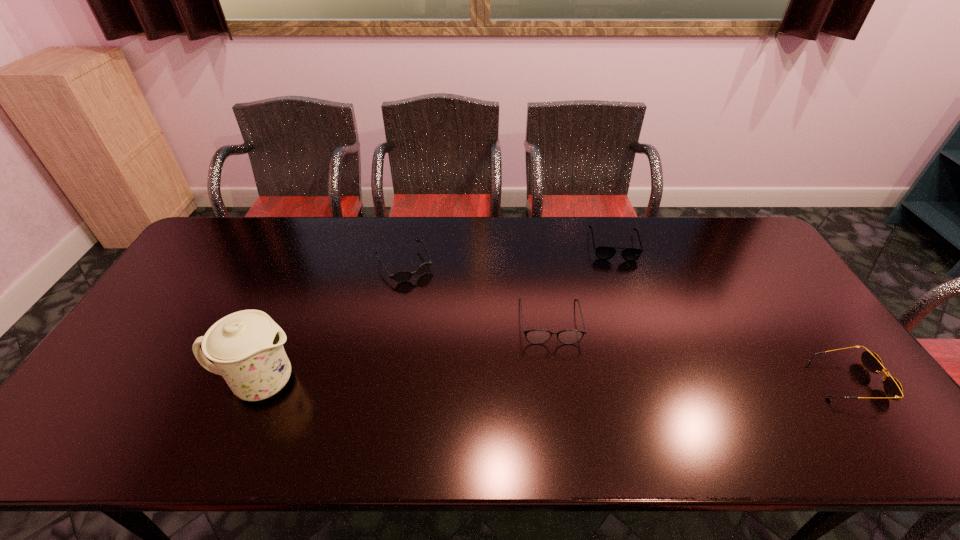
Where is `free space between the right spectacles and the third object from right to left`? This screenshot has width=960, height=540. free space between the right spectacles and the third object from right to left is located at coordinates (582, 283).

Locate an element on the screen. Image resolution: width=960 pixels, height=540 pixels. blank region between the farther sunglasses and the farther spectacles is located at coordinates (509, 254).

Locate an element on the screen. This screenshot has height=540, width=960. free space between the farther spectacles and the nearer spectacles is located at coordinates (582, 283).

The image size is (960, 540). I want to click on vacant area between the chinaware and the right sunglasses, so click(x=554, y=382).

The image size is (960, 540). In order to click on vacant region between the fourth object from left to right and the chinaware in this screenshot , I will do `click(437, 313)`.

I want to click on unoccupied position between the farther sunglasses and the nearer sunglasses, so click(626, 323).

Locate an element on the screen. The height and width of the screenshot is (540, 960). free point between the rightmost object and the third object from right to left is located at coordinates (698, 352).

Where is `empty location between the left spectacles and the fourth object from right to left`? empty location between the left spectacles and the fourth object from right to left is located at coordinates (477, 293).

Where is `vacant area that lies between the right spectacles and the third object from left to right`? This screenshot has width=960, height=540. vacant area that lies between the right spectacles and the third object from left to right is located at coordinates (582, 283).

Find the location of a particular element. unoccupied position between the left sunglasses and the rightmost object is located at coordinates (626, 323).